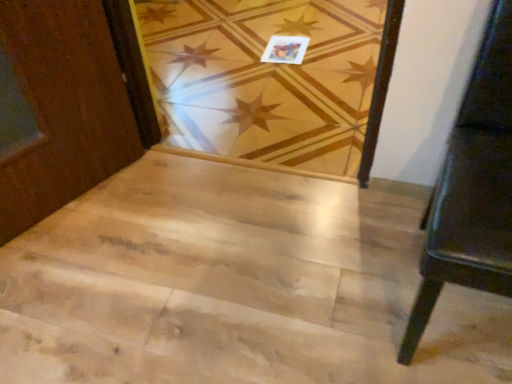
The image size is (512, 384). Identify the location of vacant area that lies to the right of matte paper postcard at upper center. (331, 45).